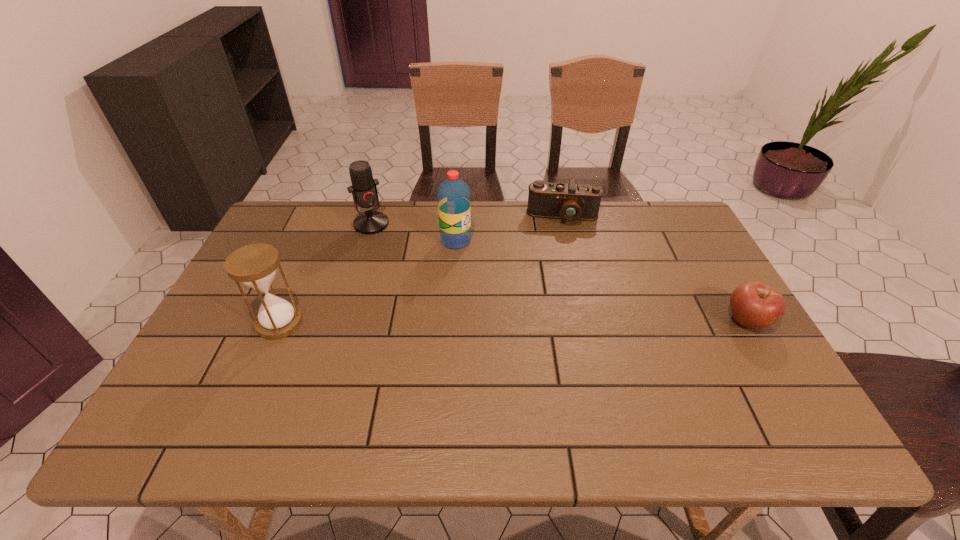
Identify the location of vacant space on the desktop that is between the hourglass and the shortest object and is positioned on the front label of the third object from right to left. Image resolution: width=960 pixels, height=540 pixels. (566, 321).

Find the location of a particular element. The height and width of the screenshot is (540, 960). free space on the desktop that is between the leftmost object and the rightmost object and is positioned on the side of the fourth object from right to left with the red ring is located at coordinates (445, 322).

What are the coordinates of `free space on the desktop that is between the hourglass and the shortest object and is positioned on the lens of the second object from right to left` in the screenshot? It's located at (566, 321).